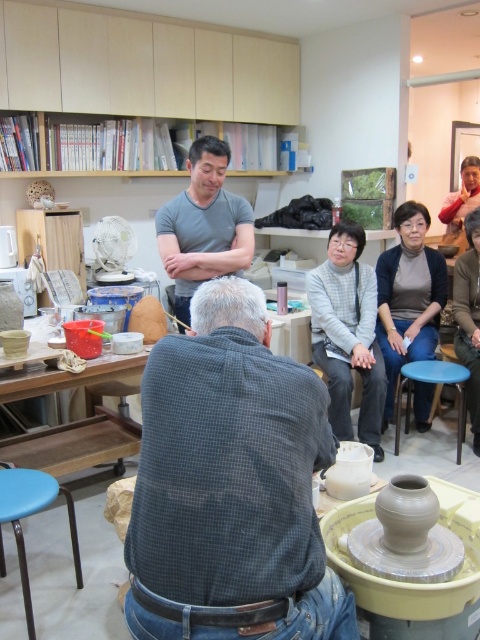
Between dark gray checkered shirt at center and gray cotton shirt at center, which one is positioned higher?

gray cotton shirt at center is higher up.

Which of these two, dark gray checkered shirt at center or gray cotton shirt at center, stands taller?

gray cotton shirt at center is taller.

Which is behind, point (303, 528) or point (220, 156)?

The point (220, 156) is more distant.

Locate an element on the screen. dark gray checkered shirt at center is located at coordinates (230, 483).

Looking at this image, between dark gray checkered shirt at center and gray flannel shirt at center, which one appears on the right side from the viewer's perspective?

Positioned to the right is gray flannel shirt at center.

Is dark gray checkered shirt at center thinner than gray flannel shirt at center?

Incorrect, dark gray checkered shirt at center's width is not less than gray flannel shirt at center's.

Locate an element on the screen. dark gray checkered shirt at center is located at coordinates (230, 483).

From the picture: Can you confirm if gray cotton shirt at center is smaller than wooden table at lower left?

Indeed, gray cotton shirt at center has a smaller size compared to wooden table at lower left.

Is gray cotton shirt at center below wooden table at lower left?

Actually, gray cotton shirt at center is above wooden table at lower left.

Does point (183, 214) come in front of point (60, 381)?

No, (183, 214) is further to viewer.

The image size is (480, 640). In order to click on gray cotton shirt at center in this screenshot , I will do `click(204, 225)`.